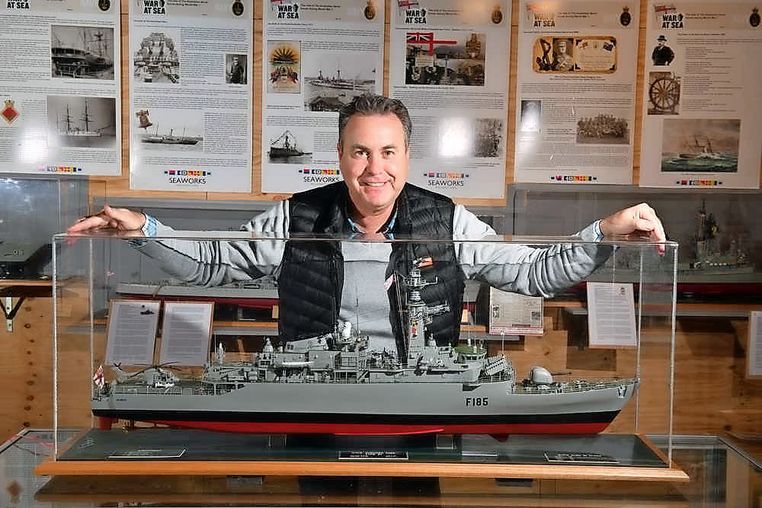
Locate an element on the screen. This screenshot has height=508, width=762. glass table is located at coordinates (351, 487).